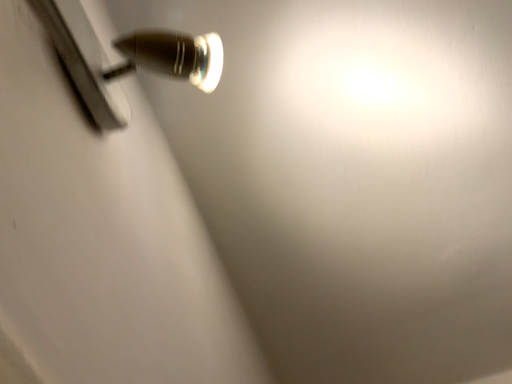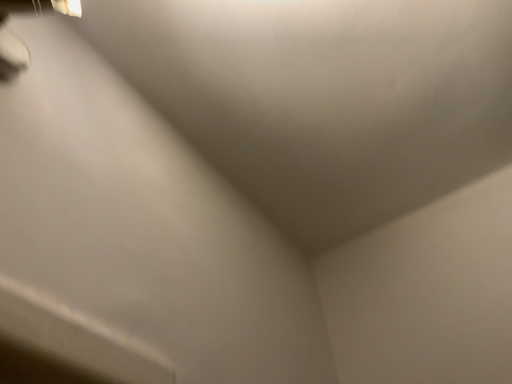
Question: Which way did the camera rotate in the video?

Choices:
 (A) rotated downward
 (B) rotated upward

Answer: (A)